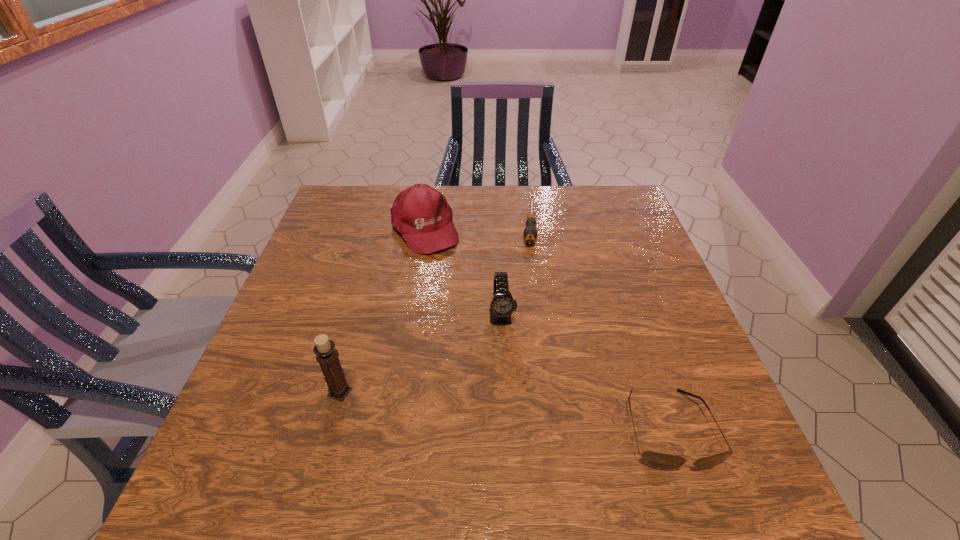
Where is `object located in the near edge section of the desktop`? Image resolution: width=960 pixels, height=540 pixels. object located in the near edge section of the desktop is located at coordinates (662, 461).

Locate an element on the screen. This screenshot has width=960, height=540. object present at the right edge is located at coordinates (662, 461).

At what (x,y) coordinates should I click in order to perform the action: click on object present at the near right corner. Please return your answer as a coordinate pair (x, y). Looking at the image, I should click on (662, 461).

The image size is (960, 540). I want to click on vacant space at the far edge of the desktop, so click(559, 204).

In the image, there is a desktop. At what (x,y) coordinates should I click in order to perform the action: click on vacant space at the near edge. Please return your answer as a coordinate pair (x, y). The height and width of the screenshot is (540, 960). Looking at the image, I should click on (382, 409).

At what (x,y) coordinates should I click in order to perform the action: click on free region at the left edge of the desktop. Please return your answer as a coordinate pair (x, y). This screenshot has height=540, width=960. Looking at the image, I should click on (356, 269).

I want to click on blank area at the right edge, so click(619, 245).

At what (x,y) coordinates should I click in order to perform the action: click on free space at the far left corner. Please return your answer as a coordinate pair (x, y). This screenshot has width=960, height=540. Looking at the image, I should click on (384, 192).

The width and height of the screenshot is (960, 540). I want to click on free space at the far right corner of the desktop, so click(x=631, y=204).

The width and height of the screenshot is (960, 540). I want to click on free space at the near right corner, so click(x=658, y=405).